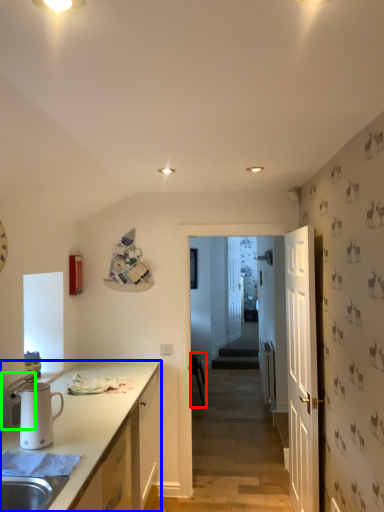
Question: Which object is the closest to the chair (highlighted by a red box)? Choose among these: cabinetry (highlighted by a blue box) or appliance (highlighted by a green box).

Choices:
 (A) cabinetry
 (B) appliance

Answer: (A)